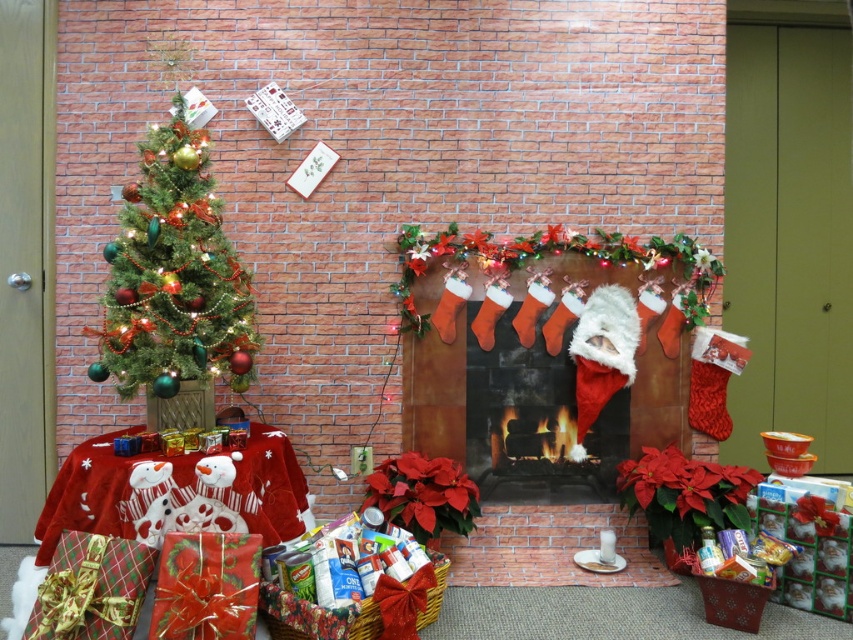
Does knitted wool fireplace at center appear under green matte christmas tree at left?

Correct, knitted wool fireplace at center is located below green matte christmas tree at left.

What do you see at coordinates (534, 369) in the screenshot? The width and height of the screenshot is (853, 640). I see `knitted wool fireplace at center` at bounding box center [534, 369].

Identify the location of knitted wool fireplace at center. 534,369.

You are a GUI agent. You are given a task and a screenshot of the screen. Output one action in this format:
    pyautogui.click(x=<x>, y=<y>)
    Task: Click on the knitted wool fireplace at center
    
    Given the screenshot: What is the action you would take?
    pyautogui.click(x=534, y=369)